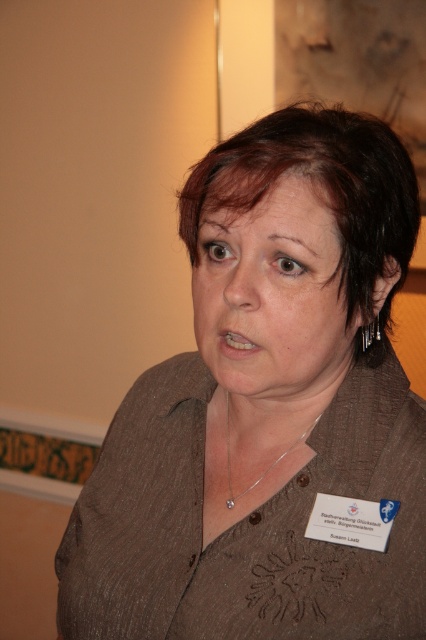
Between dark brown hair at center and silver metallic necklace at center, which one appears on the right side from the viewer's perspective?

From the viewer's perspective, dark brown hair at center appears more on the right side.

Is dark brown hair at center positioned behind silver metallic necklace at center?

No, it is in front of silver metallic necklace at center.

Who is more forward, [386,204] or [229,481]?

Point [386,204] is in front.

You are a GUI agent. You are given a task and a screenshot of the screen. Output one action in this format:
    pyautogui.click(x=<x>, y=<y>)
    Task: Click on the dark brown hair at center
    The height and width of the screenshot is (640, 426).
    Given the screenshot: What is the action you would take?
    pyautogui.click(x=322, y=193)

Is brown textured shirt at center positioned behind silver metallic earring at upper right?

No.

Which of these two, brown textured shirt at center or silver metallic earring at upper right, stands taller?

brown textured shirt at center is taller.

Does point (268, 576) come behind point (362, 326)?

No, it is in front of (362, 326).

Find the location of a particular element. This screenshot has width=426, height=640. brown textured shirt at center is located at coordinates (267, 408).

Find the location of `brown textured shirt at center`. brown textured shirt at center is located at coordinates (267, 408).

Identify the location of brown textured shirt at center. (267, 408).